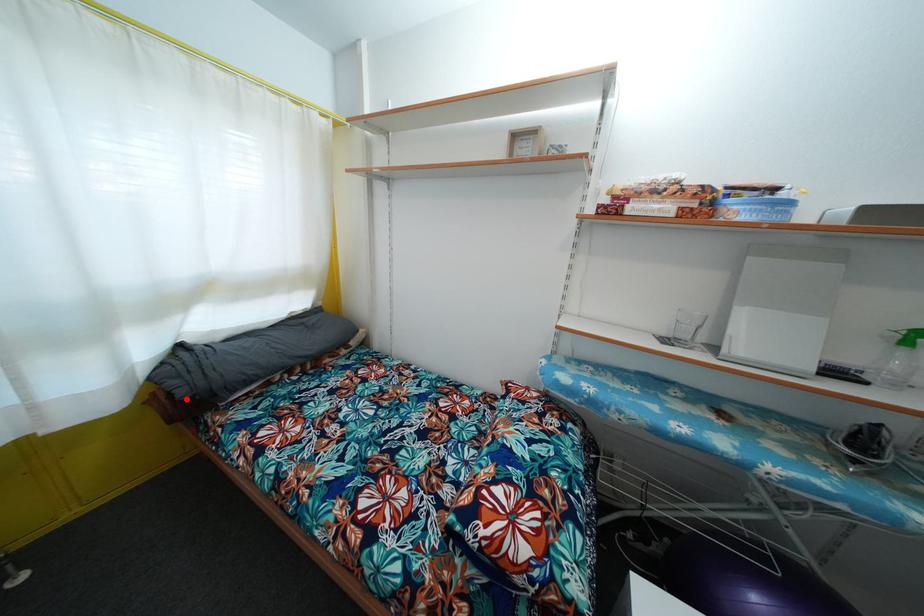
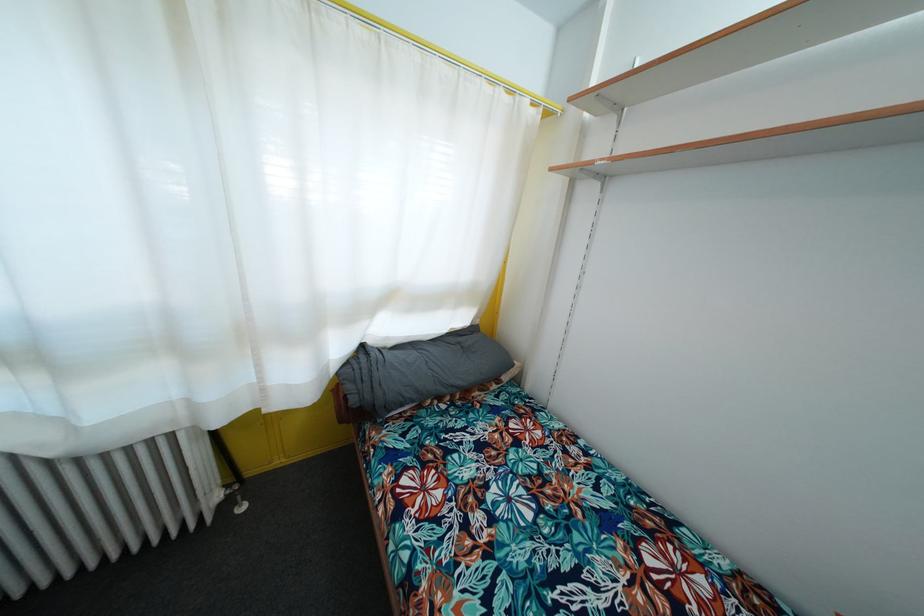
Find the pixel in the second image that matches the highlighted location in the first image.

(358, 407)